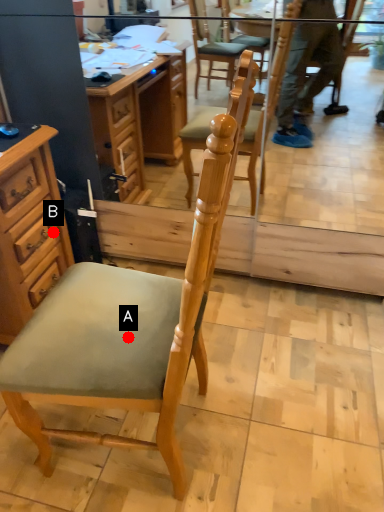
Question: Two points are circled on the image, labeled by A and B beside each circle. Among these points, which one is farthest from the camera?

Choices:
 (A) A is further
 (B) B is further

Answer: (B)